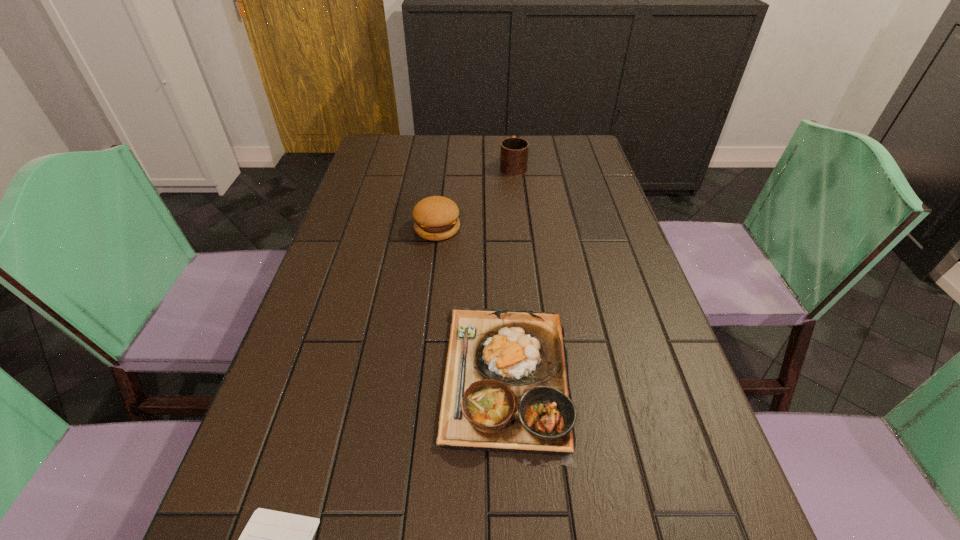
I want to click on mug, so click(x=514, y=151).

The height and width of the screenshot is (540, 960). I want to click on the third nearest object, so click(436, 218).

Where is `the second nearest object`? The height and width of the screenshot is (540, 960). the second nearest object is located at coordinates (506, 388).

This screenshot has height=540, width=960. Find the location of `the third tallest object`. the third tallest object is located at coordinates (506, 388).

Locate an element on the screen. The width and height of the screenshot is (960, 540). vacant space located 0.130m on the side of the mug with the handle is located at coordinates (510, 138).

At what (x,y) coordinates should I click in order to perform the action: click on free space located 0.100m on the side of the mug with the handle. Please return your answer as a coordinate pair (x, y). This screenshot has height=540, width=960. Looking at the image, I should click on (511, 142).

Identify the location of free space located on the right of the hamburger. The image size is (960, 540). (509, 228).

Find the location of a particular element. This screenshot has height=540, width=960. vacant region located on the back of the second nearest object is located at coordinates (500, 275).

Locate an element on the screen. The width and height of the screenshot is (960, 540). object present at the far edge is located at coordinates (514, 151).

In the image, there is a desktop. Identify the location of vacant space at the far edge. Image resolution: width=960 pixels, height=540 pixels. (448, 153).